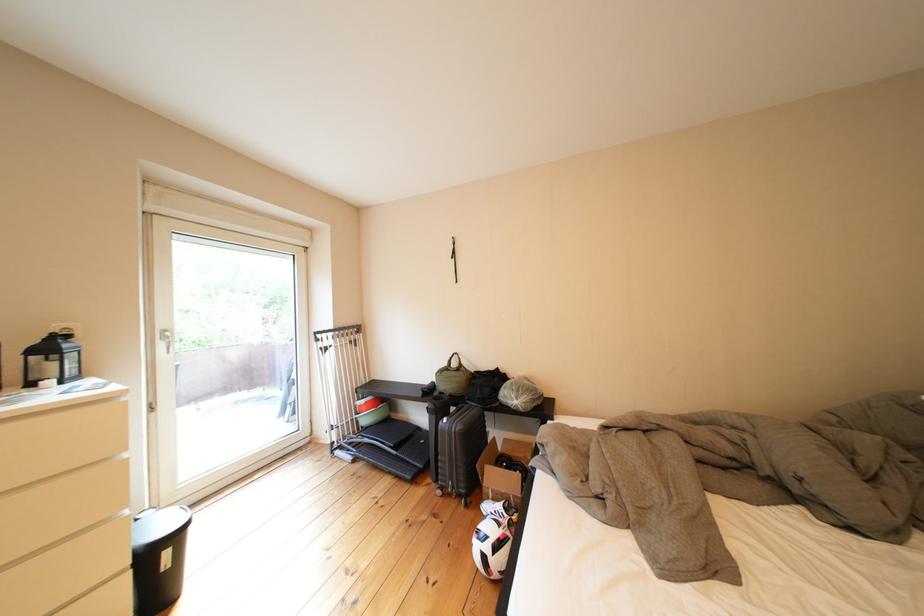
What do you see at coordinates (465, 415) in the screenshot? The image size is (924, 616). I see `the black suitcase handle` at bounding box center [465, 415].